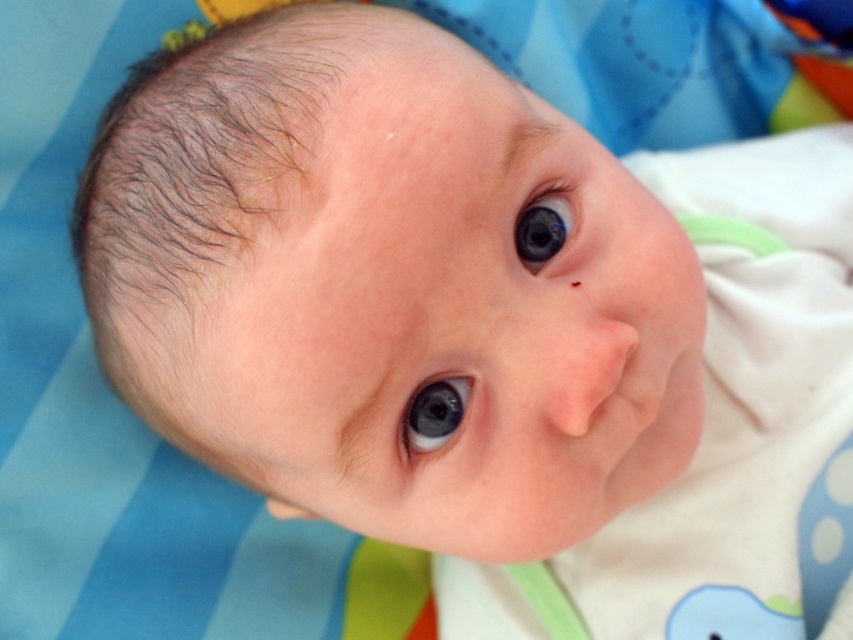
In the scene shown: You are a photographer trying to capture a closeup of a baby. You are standing at the point marked as point (415, 408). The camera is 23.45 inches away from you. Can you adjust your position to get a better shot without moving the camera?

The point (415, 408) is 23.45 inches away from the camera. To get a better shot, you can move closer to the camera while staying at the point (415, 408) to reduce the distance, but since the camera is fixed, adjusting your position within the allowed range might help achieve the desired focus or framing.